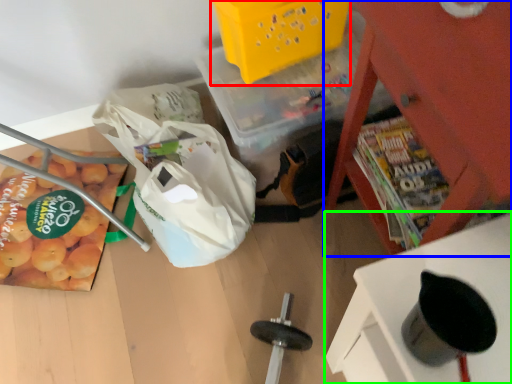
Question: Based on their relative distances, which object is nearer to basket (highlighted by a red box)? Choose from furniture (highlighted by a blue box) and furniture (highlighted by a green box).

Choices:
 (A) furniture
 (B) furniture

Answer: (A)